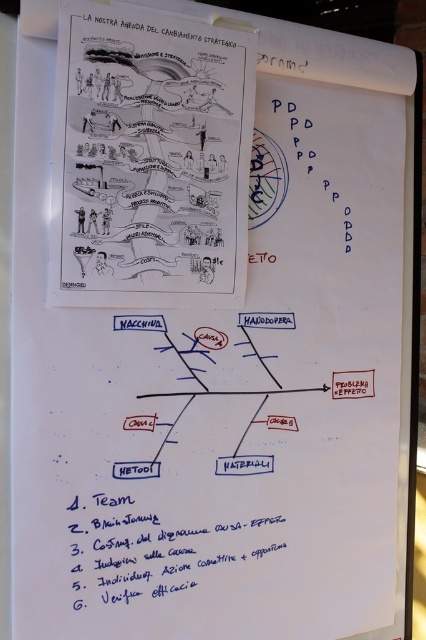
The width and height of the screenshot is (426, 640). Describe the element at coordinates (161, 547) in the screenshot. I see `black paper at lower left` at that location.

You are a GUI agent. You are given a task and a screenshot of the screen. Output one action in this format:
    pyautogui.click(x=<x>, y=<y>)
    Task: Click on the black paper at lower left
    This screenshot has width=426, height=640.
    Given the screenshot: What is the action you would take?
    pos(161,547)

Locate an element on the screen. black paper at lower left is located at coordinates (161, 547).

What do you see at coordinates (149, 161) in the screenshot? I see `black paper poster at upper center` at bounding box center [149, 161].

Is black paper poster at upper center positioned at the back of black paper at lower left?

No, black paper poster at upper center is in front of black paper at lower left.

What do you see at coordinates (149, 161) in the screenshot? The image size is (426, 640). I see `black paper poster at upper center` at bounding box center [149, 161].

What are the coordinates of `black paper poster at upper center` in the screenshot? It's located at (149, 161).

Between point (92, 76) and point (134, 17), which one is positioned behind?

The point (134, 17) is more distant.

Can you confirm if black paper poster at upper center is positioned below black paper at upper center?

Yes, black paper poster at upper center is below black paper at upper center.

Which is behind, point (195, 184) or point (141, 10)?

The point (195, 184) is more distant.

Find the location of a particular element. This screenshot has height=640, width=426. black paper poster at upper center is located at coordinates coord(149,161).